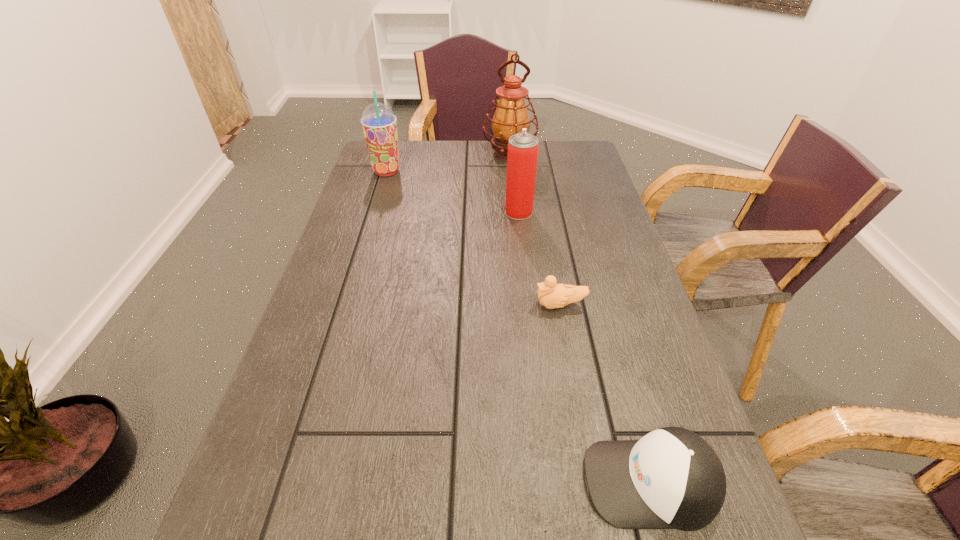
Find the location of a particular element. The width and height of the screenshot is (960, 540). oil lamp is located at coordinates (511, 115).

Image resolution: width=960 pixels, height=540 pixels. Find the location of `smoothie`. smoothie is located at coordinates (379, 123).

The height and width of the screenshot is (540, 960). I want to click on aerosol can, so click(x=523, y=147).

Identify the location of the fourth tallest object. (671, 478).

Where is `the nearest object`? The height and width of the screenshot is (540, 960). the nearest object is located at coordinates (671, 478).

Find the location of a particular element. This screenshot has width=960, height=540. the shortest object is located at coordinates (551, 295).

What are the coordinates of `duckling` in the screenshot? It's located at (551, 295).

This screenshot has height=540, width=960. Identify the location of vacant region located 0.230m on the front of the oil lamp. (515, 208).

This screenshot has height=540, width=960. Find the location of `free point located on the right of the smoothie`. free point located on the right of the smoothie is located at coordinates (496, 171).

Identify the location of vacant area located 0.120m on the front of the aerosol can. This screenshot has width=960, height=540. (522, 247).